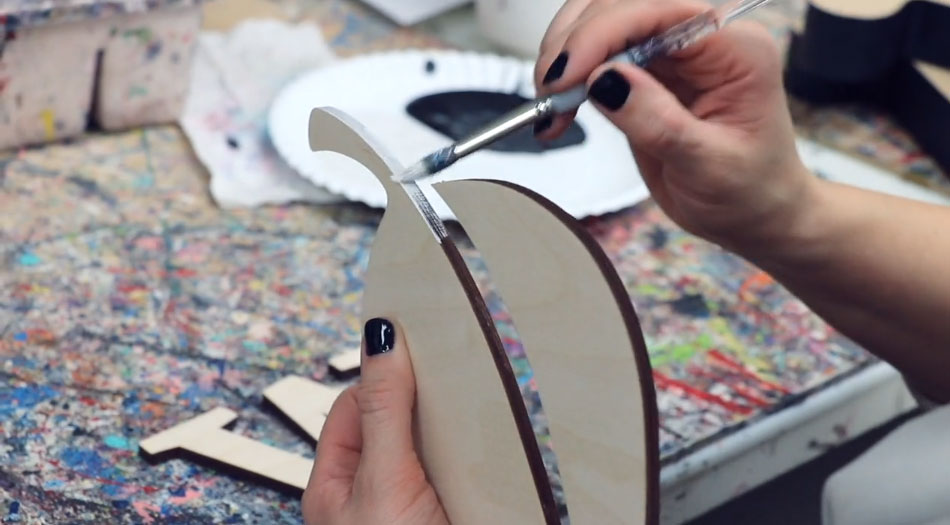
The height and width of the screenshot is (525, 950). Identify the location of tip of paint brush. (408, 174).